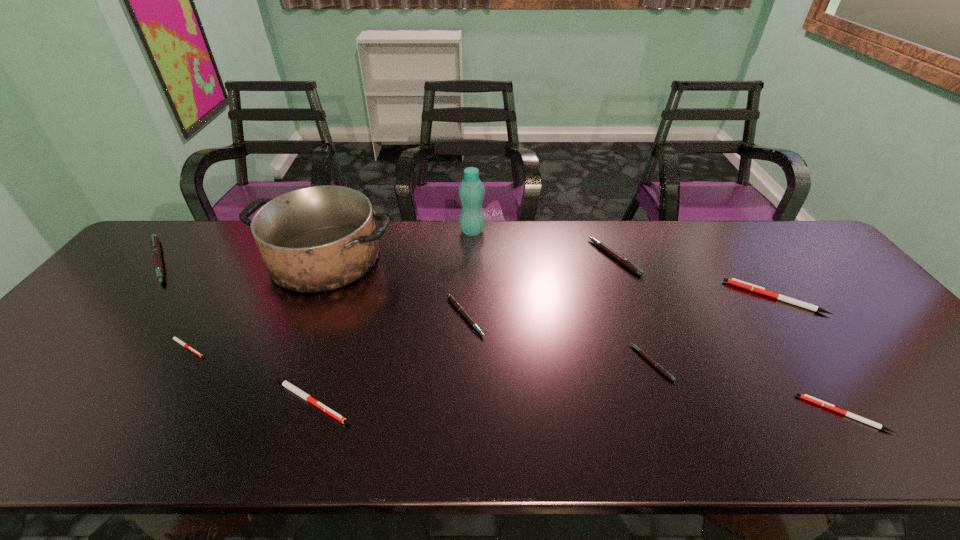
You are a GUI agent. You are given a task and a screenshot of the screen. Output one action in this format:
    pyautogui.click(x=<x>, y=<y>)
    Task: Click on the tallest object
    This screenshot has height=540, width=960.
    Given the screenshot: What is the action you would take?
    pyautogui.click(x=471, y=191)

Identify the location of saucepan. (315, 239).

At what (x,y) coordinates should I click in order to perform the action: click on the biggest pink pen. Please return your answer as a coordinate pair (x, y). Looking at the image, I should click on (155, 245).

Identify the location of the leftmost pink pen. This screenshot has height=540, width=960. (155, 245).

The image size is (960, 540). Identify the location of the third smallest pink pen. (619, 258).

You are a GUI agent. You are given a task and a screenshot of the screen. Output one action in this format:
    pyautogui.click(x=<x>, y=<y>)
    Task: Click on the farthest white pen
    This screenshot has height=540, width=960.
    Given the screenshot: What is the action you would take?
    pyautogui.click(x=733, y=281)

The height and width of the screenshot is (540, 960). What are the coordinates of `the second pink pen from left to right` in the screenshot? It's located at (458, 306).

The width and height of the screenshot is (960, 540). I want to click on the third farthest pink pen, so click(x=458, y=306).

Locate an element on the screen. Image resolution: width=960 pixels, height=540 pixels. the third white pen from right to left is located at coordinates (286, 384).

Find the location of a particular element. the second biggest white pen is located at coordinates (286, 384).